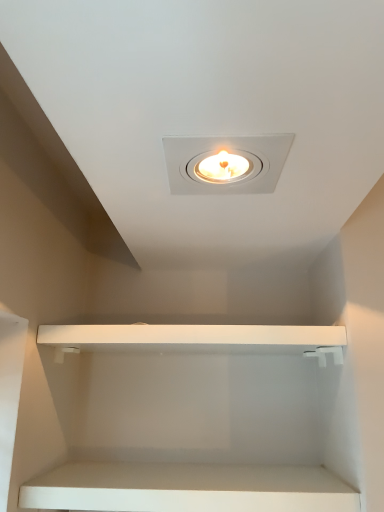
Question: In the image, is white matte cabinet at lower center, which is the 1th cabinet from bottom to top, positioned in front of or behind white matte shelf at center, which is the first cabinet from top to bottom?

Choices:
 (A) front
 (B) behind

Answer: (A)

Question: Is white matte cabinet at lower center, which appears as the 2th cabinet when viewed from the top, wider or thinner than white matte shelf at center, which is the first cabinet from top to bottom?

Choices:
 (A) wide
 (B) thin

Answer: (B)

Question: Based on their sizes in the image, would you say white matte cabinet at lower center, which appears as the 2th cabinet when viewed from the top, is bigger or smaller than white matte shelf at center, which is the first cabinet from top to bottom?

Choices:
 (A) small
 (B) big

Answer: (A)

Question: Relative to white matte cabinet at lower center, which is the 1th cabinet from bottom to top, is white matte shelf at center, which ranks as the 2th cabinet in bottom-to-top order, in front or behind?

Choices:
 (A) behind
 (B) front

Answer: (A)

Question: Does point (150, 348) appear closer or farther from the camera than point (201, 498)?

Choices:
 (A) farther
 (B) closer

Answer: (A)

Question: In terms of height, does white matte shelf at center, which is the first cabinet from top to bottom, look taller or shorter compared to white matte cabinet at lower center, which is the 1th cabinet from bottom to top?

Choices:
 (A) tall
 (B) short

Answer: (A)

Question: Is white matte shelf at center, which is the first cabinet from top to bottom, to the left or to the right of white matte cabinet at lower center, which appears as the 2th cabinet when viewed from the top, in the image?

Choices:
 (A) right
 (B) left

Answer: (A)